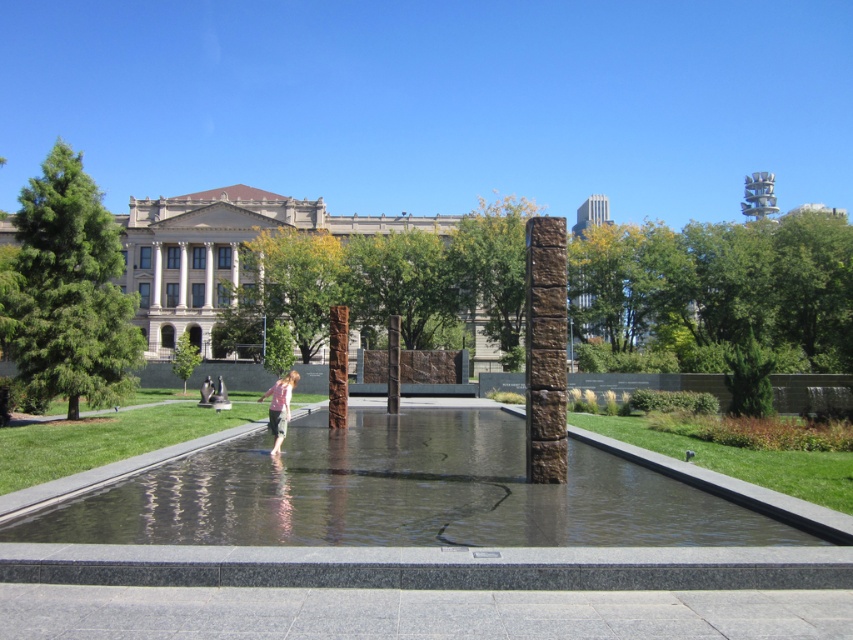
You are a landscape architect designing a new park. You need to place a new statue that requires a base larger than the brown stone pillar at center. Can the green leafy tree at center provide enough space for the statue base?

The green leafy tree at center occupies more space than the brown stone pillar at center, so it can provide enough space for the statue base.